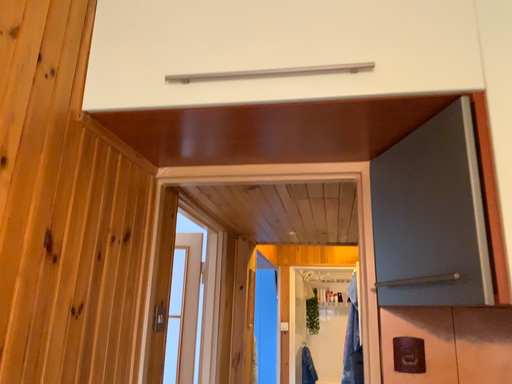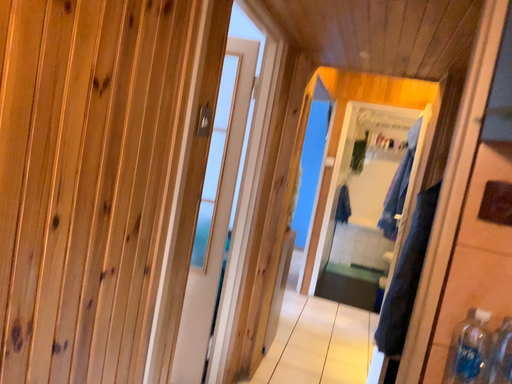
Question: How did the camera likely rotate when shooting the video?

Choices:
 (A) rotated downward
 (B) rotated upward

Answer: (A)